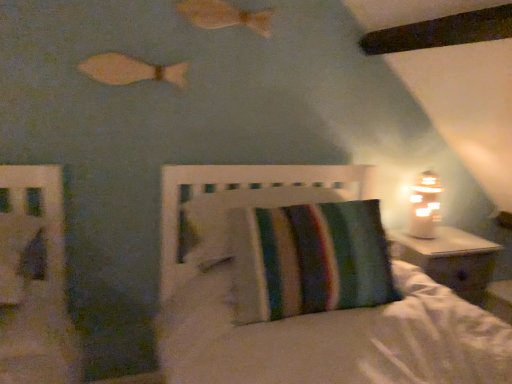
Question: From a real-world perspective, is white frosted glass table lamp at right physically located above or below striped fabric headboard at center?

Choices:
 (A) above
 (B) below

Answer: (A)

Question: Is point (423, 215) positioned closer to the camera than point (169, 286)?

Choices:
 (A) closer
 (B) farther

Answer: (B)

Question: Which object is the farthest from the white frosted glass table lamp at right?

Choices:
 (A) striped fabric pillow at center
 (B) wooden fish at upper center, positioned as the 2th fish in left-to-right order
 (C) wooden fish at upper left, positioned as the 1th fish in bottom-to-top order
 (D) striped fabric headboard at center

Answer: (C)

Question: Which object is the farthest from the striped fabric headboard at center?

Choices:
 (A) striped fabric pillow at center
 (B) wooden fish at upper left, positioned as the 1th fish in bottom-to-top order
 (C) wooden fish at upper center, the 2th fish from the bottom
 (D) white frosted glass table lamp at right

Answer: (C)